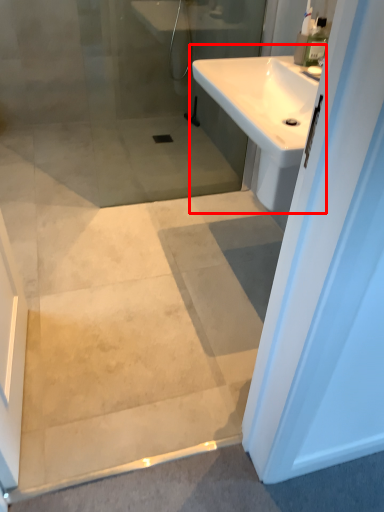
Question: From the image's perspective, considering the relative positions of sink (annotated by the red box) and toiletry in the image provided, where is sink (annotated by the red box) located with respect to the staircase?

Choices:
 (A) below
 (B) above

Answer: (A)